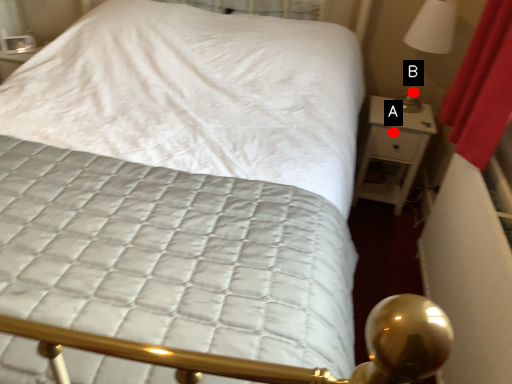
Question: Two points are circled on the image, labeled by A and B beside each circle. Which point is closer to the camera taking this photo?

Choices:
 (A) A is closer
 (B) B is closer

Answer: (A)